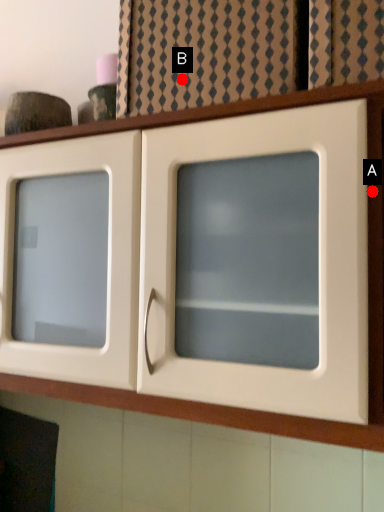
Question: Two points are circled on the image, labeled by A and B beside each circle. Which of the following is the closest to the observer?

Choices:
 (A) A is closer
 (B) B is closer

Answer: (A)